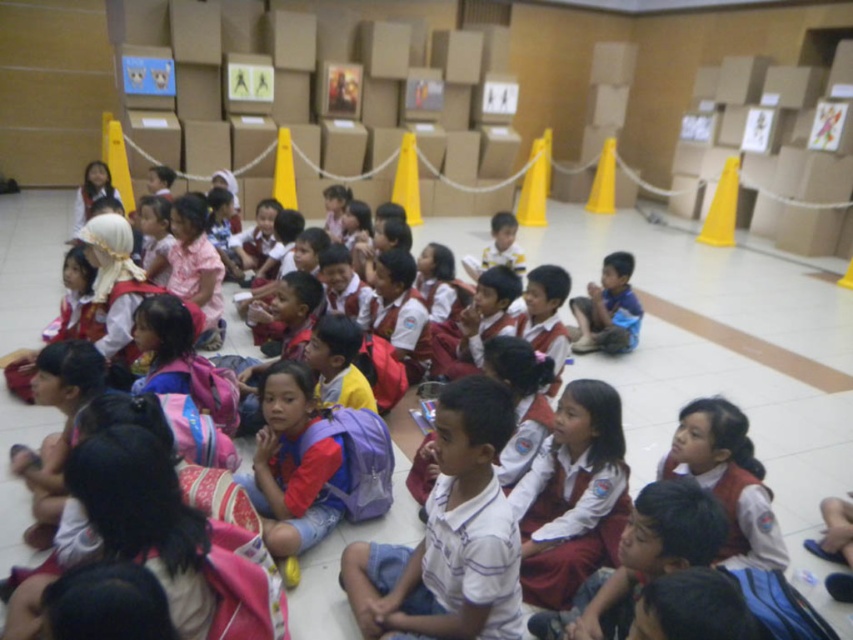
Can you confirm if white cotton shirt at center is shorter than blue fabric shirt at center?

Yes, white cotton shirt at center is shorter than blue fabric shirt at center.

I want to click on white cotton shirt at center, so click(474, 557).